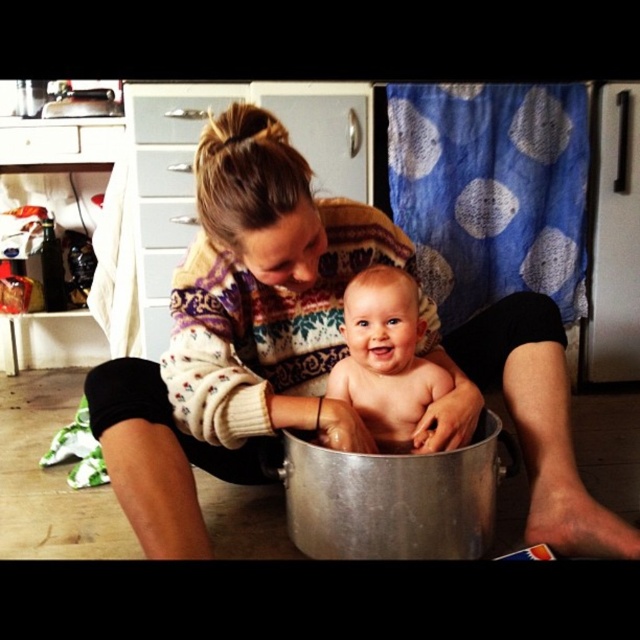
You are a photographer trying to capture a candid shot of the scene. Since you want to focus on the baby, which object should you avoid placing in the foreground to prevent blocking the baby? Please choose between the white knitted sweater at center and the smooth skin baby at center.

The white knitted sweater at center is taller than the smooth skin baby at center, so you should avoid placing the white knitted sweater at center in the foreground to prevent blocking the baby.

You are a photographer trying to capture a candid shot of the white knitted sweater at center and the smooth skin baby at center. Since you want to focus on the baby, where should you position your camera relative to the sweater?

The white knitted sweater at center is below the smooth skin baby at center, so you should position your camera above the white knitted sweater at center to focus on the baby.

In the scene described, the woman is wearing a white knitted sweater at center and holding a smooth skin baby at center. Which object takes up more space in the image?

The white knitted sweater at center is bigger than the smooth skin baby at center, so it takes up more space in the image.